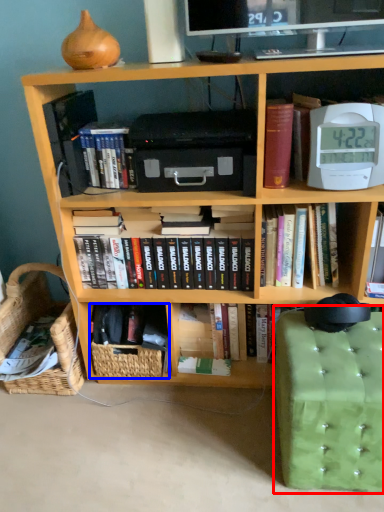
Question: Which point is further to the camera, swivel chair (highlighted by a red box) or basket (highlighted by a blue box)?

Choices:
 (A) swivel chair
 (B) basket

Answer: (B)